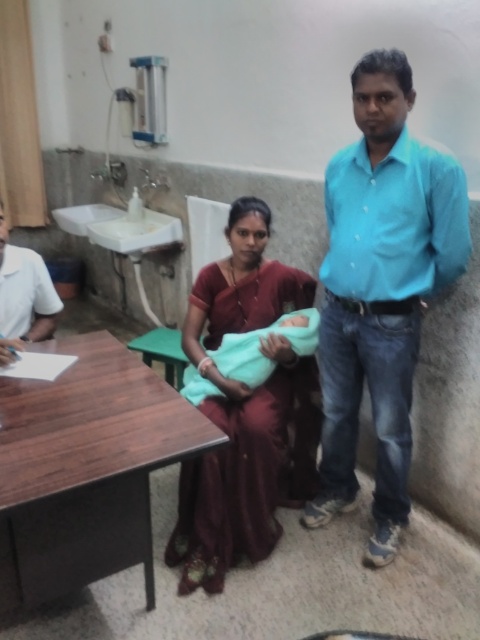
Which is behind, point (384, 305) or point (2, 273)?

Point (2, 273)

Locate an element on the screen. The image size is (480, 640). blue cotton shirt at right is located at coordinates (381, 289).

Is blue cotton shirt at right above wooden table at lower left?

Indeed, blue cotton shirt at right is positioned over wooden table at lower left.

Is blue cotton shirt at right thinner than wooden table at lower left?

Correct, blue cotton shirt at right's width is less than wooden table at lower left's.

What are the coordinates of `blue cotton shirt at right` in the screenshot? It's located at (381, 289).

Where is `blue cotton shirt at right`? This screenshot has width=480, height=640. blue cotton shirt at right is located at coordinates (381, 289).

Is wooden table at lower left below maroon silk saree at center?

Indeed, wooden table at lower left is positioned under maroon silk saree at center.

Who is higher up, wooden table at lower left or maroon silk saree at center?

Positioned higher is maroon silk saree at center.

Image resolution: width=480 pixels, height=640 pixels. What do you see at coordinates (84, 468) in the screenshot? I see `wooden table at lower left` at bounding box center [84, 468].

Locate an element on the screen. Image resolution: width=480 pixels, height=640 pixels. wooden table at lower left is located at coordinates (84, 468).